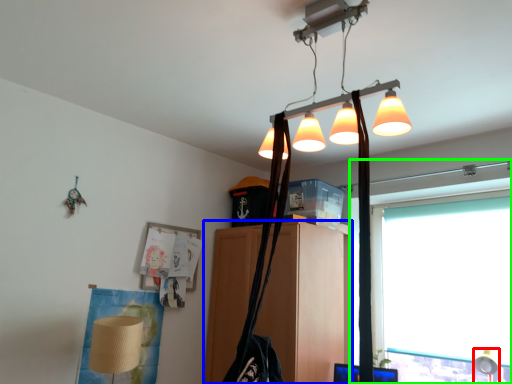
Question: Which is nearer to the table lamp (highlighted by a red box)? furniture (highlighted by a blue box) or window (highlighted by a green box).

Choices:
 (A) furniture
 (B) window

Answer: (B)